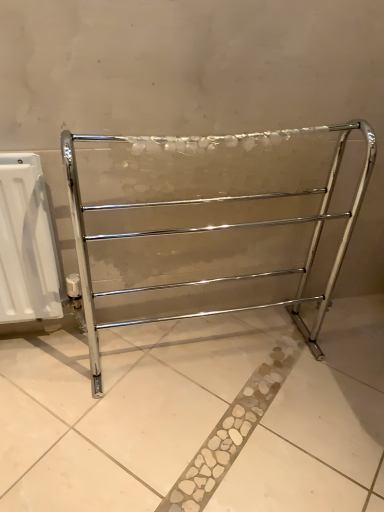
Question: From a real-world perspective, is white plastic radiator at left positioned above or below polished chrome towel rack at center?

Choices:
 (A) above
 (B) below

Answer: (B)

Question: Is white plastic radiator at left wider or thinner than polished chrome towel rack at center?

Choices:
 (A) wide
 (B) thin

Answer: (B)

Question: Which is correct: white plastic radiator at left is inside polished chrome towel rack at center, or outside of it?

Choices:
 (A) inside
 (B) outside

Answer: (B)

Question: Relative to white plastic radiator at left, is polished chrome towel rack at center in front or behind?

Choices:
 (A) front
 (B) behind

Answer: (A)

Question: From the image's perspective, is polished chrome towel rack at center positioned above or below white plastic radiator at left?

Choices:
 (A) above
 (B) below

Answer: (A)

Question: Is polished chrome towel rack at center bigger or smaller than white plastic radiator at left?

Choices:
 (A) small
 (B) big

Answer: (B)

Question: Considering the positions of point (276, 135) and point (39, 268), is point (276, 135) closer or farther from the camera than point (39, 268)?

Choices:
 (A) closer
 (B) farther

Answer: (A)